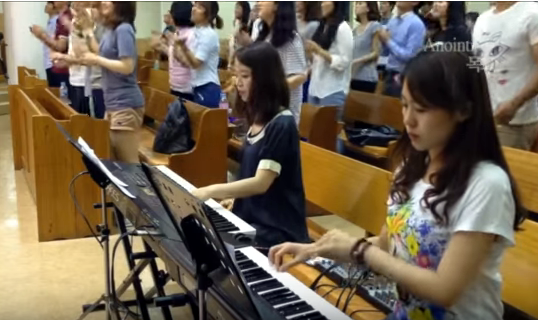
You are a GUI agent. You are given a task and a screenshot of the screen. Output one action in this format:
    pyautogui.click(x=<x>, y=<y>)
    Task: Click on the benches
    This screenshot has height=320, width=538.
    Given the screenshot: What is the action you would take?
    pyautogui.click(x=209, y=149), pyautogui.click(x=324, y=176), pyautogui.click(x=329, y=122), pyautogui.click(x=359, y=107), pyautogui.click(x=523, y=175), pyautogui.click(x=49, y=189)